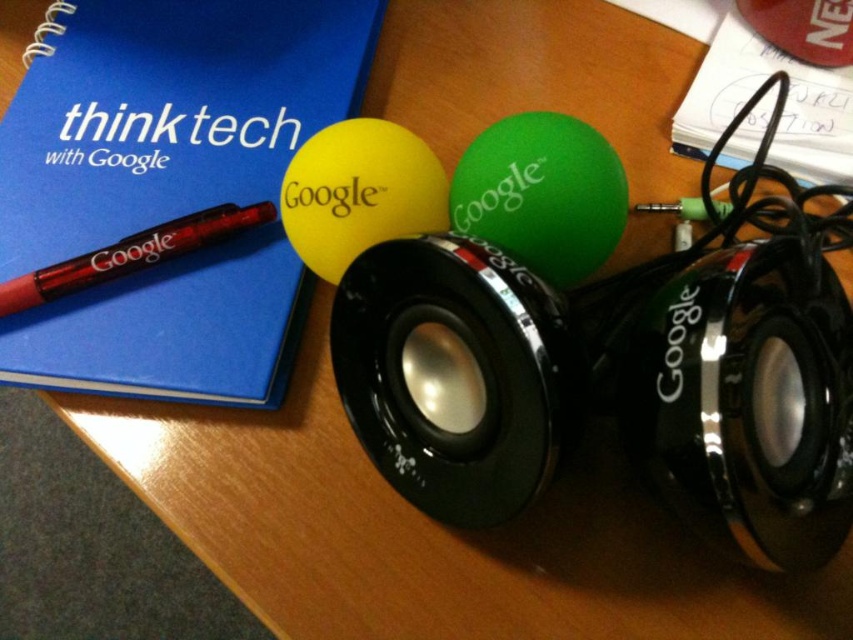
Which is in front, point (611, 193) or point (345, 236)?

Point (611, 193) is in front.

This screenshot has width=853, height=640. Describe the element at coordinates (541, 195) in the screenshot. I see `green rubber balloon at center` at that location.

I want to click on green rubber balloon at center, so click(x=541, y=195).

Which is below, black metallic speaker at center or translucent red pen at left?

Positioned lower is black metallic speaker at center.

Does black metallic speaker at center have a lesser height compared to translucent red pen at left?

No.

What do you see at coordinates (746, 401) in the screenshot? I see `black metallic speaker at center` at bounding box center [746, 401].

Where is `black metallic speaker at center`? black metallic speaker at center is located at coordinates click(x=746, y=401).

Between black metallic speaker at center and green rubber balloon at center, which one has more height?

black metallic speaker at center

Does black metallic speaker at center have a smaller size compared to green rubber balloon at center?

Actually, black metallic speaker at center might be larger than green rubber balloon at center.

Who is more forward, (701, 296) or (570, 124)?

Point (701, 296) is in front.

Where is `black metallic speaker at center`? The height and width of the screenshot is (640, 853). black metallic speaker at center is located at coordinates (746, 401).